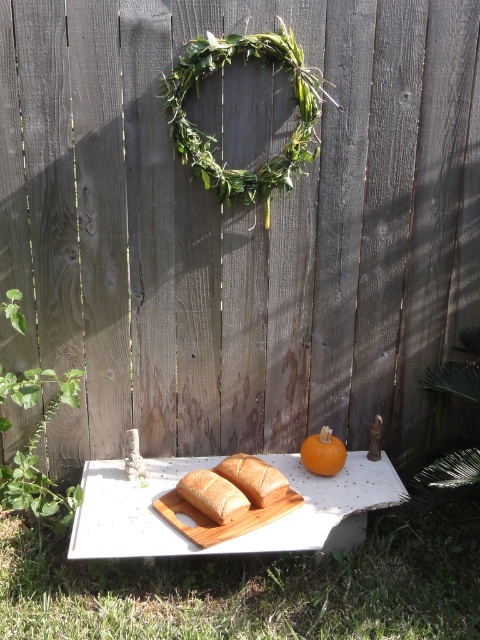
Does white matte bread at center appear on the left side of golden brown bread at center?

Indeed, white matte bread at center is positioned on the left side of golden brown bread at center.

Does white matte bread at center have a greater height compared to golden brown bread at center?

No, white matte bread at center is not taller than golden brown bread at center.

Where is `white matte bread at center`? This screenshot has width=480, height=640. white matte bread at center is located at coordinates (213, 496).

Which is more to the left, white painted wood table at center or white matte bread at center?

white matte bread at center

Does point (285, 547) lie in front of point (210, 513)?

That is True.

Does point (86, 461) come farther from viewer compared to point (192, 490)?

Yes, it is behind point (192, 490).

Identify the location of white painted wood table at center. (231, 538).

How much distance is there between golden brown bread at center and orange matte pumpkin at center?

golden brown bread at center and orange matte pumpkin at center are 7.10 inches apart from each other.

Does golden brown bread at center have a smaller size compared to orange matte pumpkin at center?

No.

Who is more distant from viewer, (273, 496) or (323, 460)?

The point (323, 460) is behind.

Find the location of a particular element. Image resolution: width=480 pixels, height=640 pixels. golden brown bread at center is located at coordinates (253, 477).